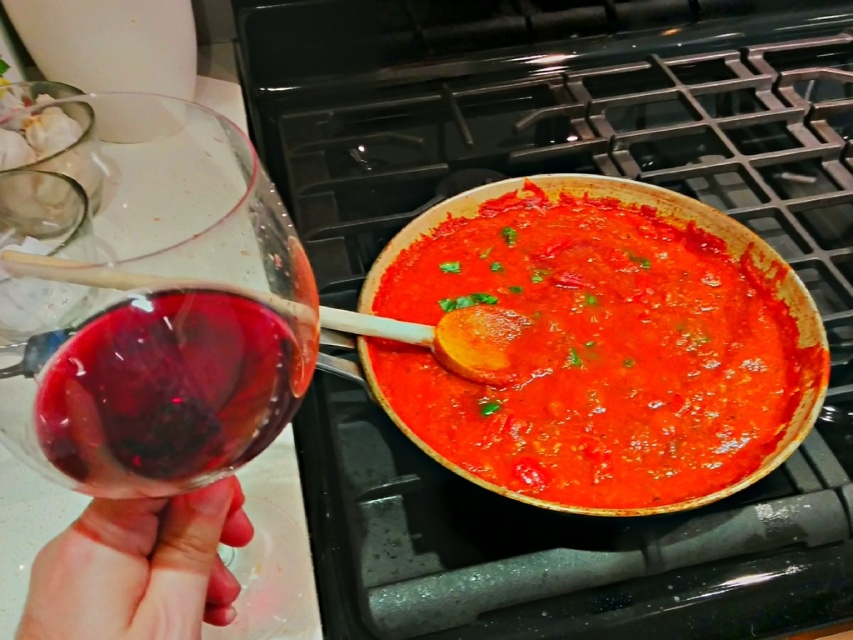
Does black matte gas stove at upper center have a smaller size compared to tomato sauce at center?

No.

Based on the photo, is black matte gas stove at upper center positioned in front of tomato sauce at center?

Yes, it is in front of tomato sauce at center.

Is point (654, 4) less distant than point (548, 426)?

No, it is not.

Locate an element on the screen. black matte gas stove at upper center is located at coordinates coord(556,172).

Which is below, tomato sauce at center or ruby glass at left?

ruby glass at left is below.

Is tomato sauce at center to the right of ruby glass at left from the viewer's perspective?

Yes, tomato sauce at center is to the right of ruby glass at left.

Is point (587, 269) farther from camera compared to point (210, 452)?

Yes, it is behind point (210, 452).

The image size is (853, 640). I want to click on tomato sauce at center, so click(x=602, y=346).

Does point (36, 192) come behind point (115, 449)?

Yes, it is behind point (115, 449).

Based on the photo, can you confirm if transparent glass at left is wider than ruby glass at left?

Indeed, transparent glass at left has a greater width compared to ruby glass at left.

What do you see at coordinates (149, 304) in the screenshot? The width and height of the screenshot is (853, 640). I see `transparent glass at left` at bounding box center [149, 304].

Identify the location of transparent glass at left. The height and width of the screenshot is (640, 853). (149, 304).